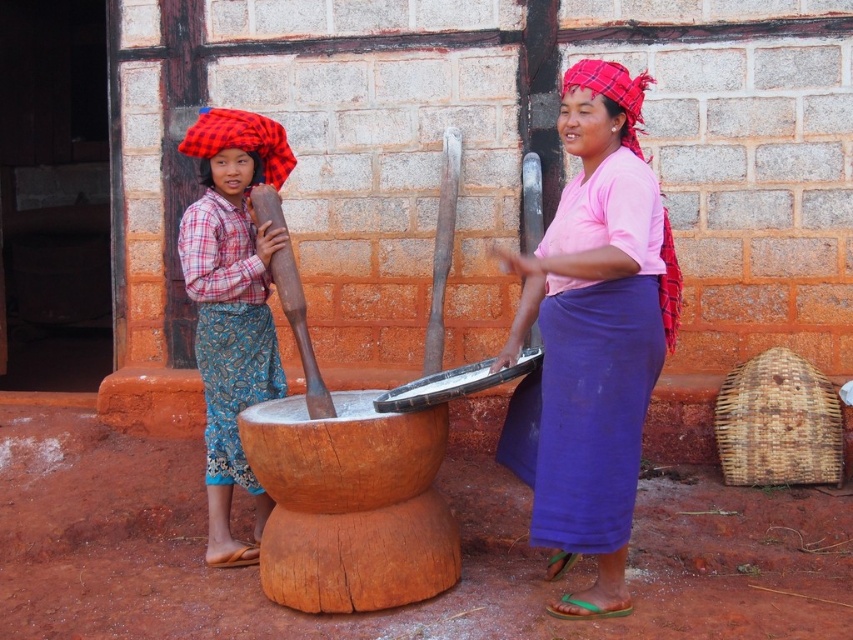
Question: Is pink fabric skirt at center below plaid fabric headscarf at left?

Choices:
 (A) no
 (B) yes

Answer: (B)

Question: Is the position of pink fabric skirt at center less distant than that of plaid fabric headscarf at left?

Choices:
 (A) no
 (B) yes

Answer: (B)

Question: Does pink fabric skirt at center have a larger size compared to plaid fabric headscarf at left?

Choices:
 (A) no
 (B) yes

Answer: (B)

Question: Which point is farther to the camera?

Choices:
 (A) pink fabric skirt at center
 (B) plaid fabric headscarf at left

Answer: (B)